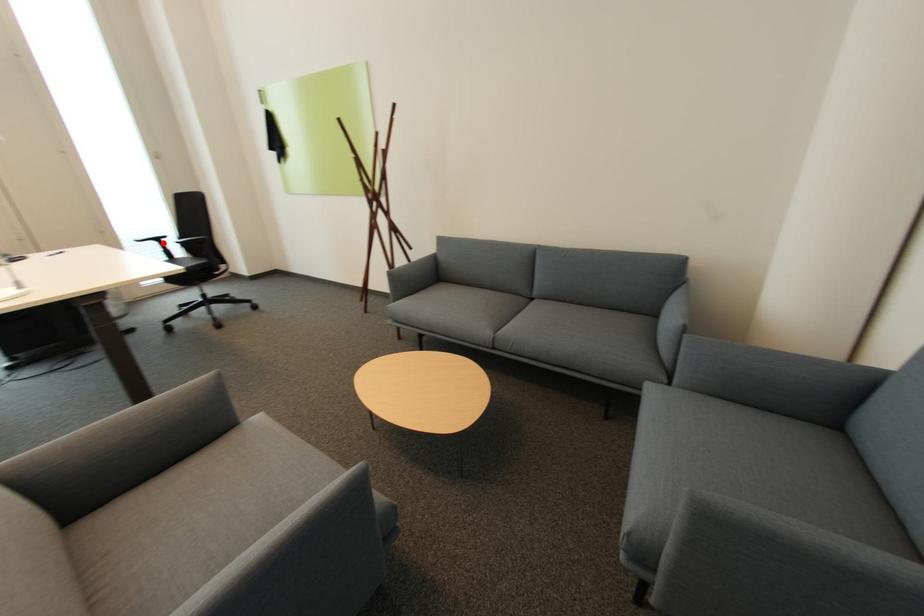
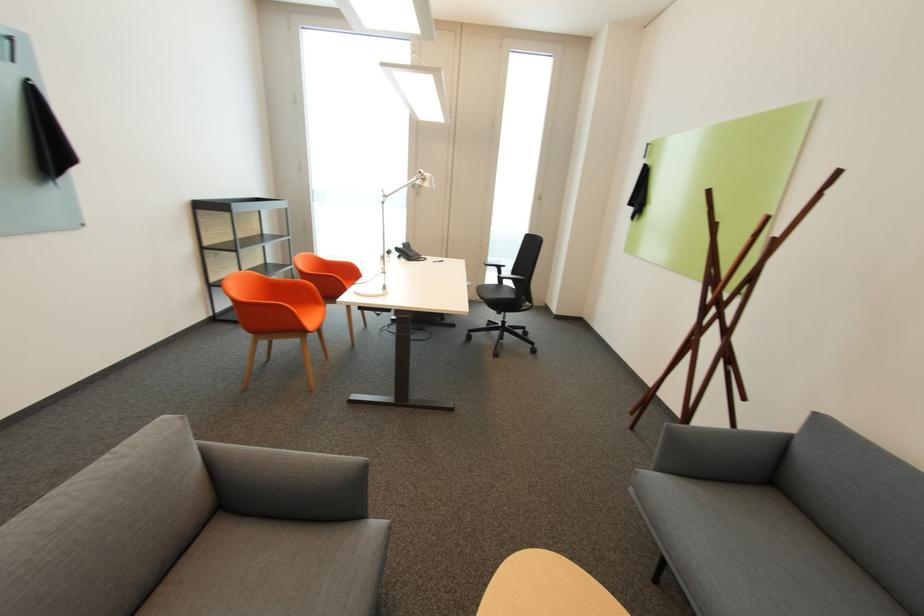
The point at the highlighted location is marked in the first image. Where is the corresponding point in the second image?

(503, 269)